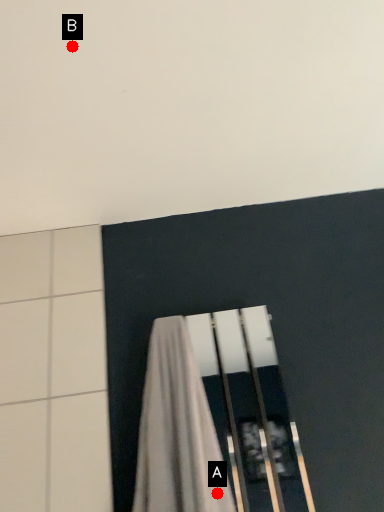
Question: Two points are circled on the image, labeled by A and B beside each circle. Which point is closer to the camera?

Choices:
 (A) A is closer
 (B) B is closer

Answer: (B)